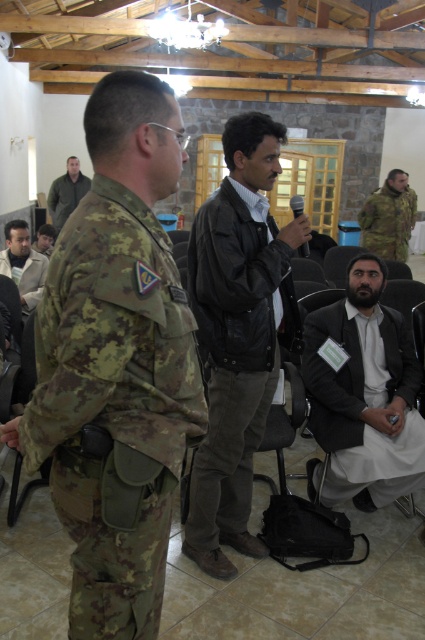
Does camouflage fabric uniform at left appear under matte black jacket at center?

Correct, camouflage fabric uniform at left is located below matte black jacket at center.

How far apart are camouflage fabric uniform at left and matte black jacket at center?

camouflage fabric uniform at left and matte black jacket at center are 3.90 meters apart from each other.

The width and height of the screenshot is (425, 640). Find the location of `camouflage fabric uniform at left`. camouflage fabric uniform at left is located at coordinates (113, 404).

You are a GUI agent. You are given a task and a screenshot of the screen. Output one action in this format:
    pyautogui.click(x=<x>, y=<y>)
    Task: Click on the camouflage fabric uniform at left
    Image resolution: width=425 pixels, height=640 pixels.
    Given the screenshot: What is the action you would take?
    pyautogui.click(x=113, y=404)

Between black leather jacket at center and camouflage fabric uniform at center, which one appears on the right side from the viewer's perspective?

From the viewer's perspective, camouflage fabric uniform at center appears more on the right side.

Who is positioned more to the left, black leather jacket at center or camouflage fabric uniform at center?

black leather jacket at center is more to the left.

Which is in front, point (258, 250) or point (382, 216)?

Positioned in front is point (258, 250).

Image resolution: width=425 pixels, height=640 pixels. Find the location of `black leather jacket at center`. black leather jacket at center is located at coordinates (238, 333).

Who is more distant from viewer, (163, 278) or (28, 296)?

Positioned behind is point (28, 296).

Does camouflage fabric uniform at left have a greater width compared to light brown leather jacket at lower left?

Indeed, camouflage fabric uniform at left has a greater width compared to light brown leather jacket at lower left.

Who is more forward, (172, 477) or (13, 268)?

Point (172, 477)

Locate an element on the screen. The image size is (425, 640). camouflage fabric uniform at left is located at coordinates (113, 404).